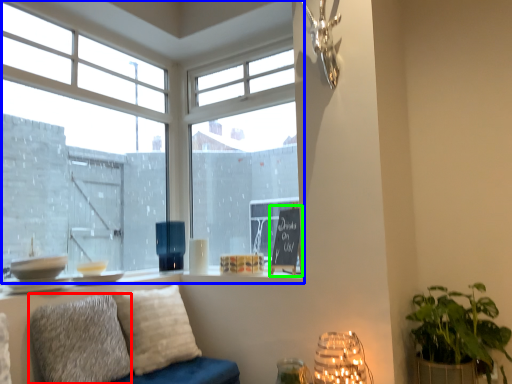
Question: Based on their relative distances, which object is farther from pillow (highlighted by a red box)? Choose from window (highlighted by a blue box) and bulletin board (highlighted by a green box).

Choices:
 (A) window
 (B) bulletin board

Answer: (A)